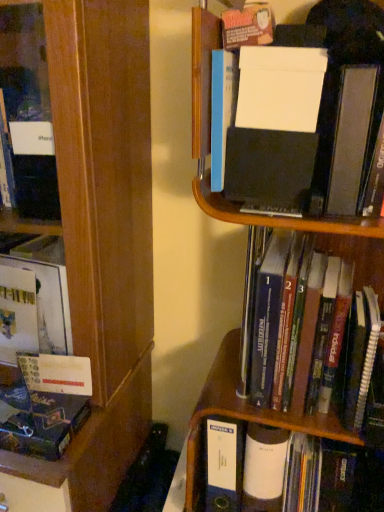
Question: Is wooden bookcase at left placed right next to white matte folder at upper right, marked as the 2th book in a right-to-left arrangement?

Choices:
 (A) yes
 (B) no

Answer: (B)

Question: Is wooden bookcase at left closer to the viewer compared to white matte folder at upper right, arranged as the third book when ordered from the bottom?

Choices:
 (A) no
 (B) yes

Answer: (B)

Question: Is wooden bookcase at left bigger than white matte folder at upper right, the 1th book in the top-to-bottom sequence?

Choices:
 (A) yes
 (B) no

Answer: (A)

Question: Considering the relative sizes of wooden bookcase at left and white matte folder at upper right, marked as the 2th book in a right-to-left arrangement, in the image provided, is wooden bookcase at left smaller than white matte folder at upper right, marked as the 2th book in a right-to-left arrangement,?

Choices:
 (A) no
 (B) yes

Answer: (A)

Question: Does wooden bookcase at left have a lesser height compared to white matte folder at upper right, marked as the 2th book in a right-to-left arrangement?

Choices:
 (A) no
 (B) yes

Answer: (A)

Question: From the image's perspective, does wooden bookcase at left appear higher than white matte folder at upper right, marked as the 2th book in a right-to-left arrangement?

Choices:
 (A) yes
 (B) no

Answer: (B)

Question: Are hardcover book at center, the 3th book from the left, and wooden bookcase at left located far from each other?

Choices:
 (A) no
 (B) yes

Answer: (A)

Question: Considering the relative positions of hardcover book at center, the 1th book positioned from the right, and wooden bookcase at left in the image provided, is hardcover book at center, the 1th book positioned from the right, to the left of wooden bookcase at left from the viewer's perspective?

Choices:
 (A) yes
 (B) no

Answer: (B)

Question: Does hardcover book at center, which is the second book in bottom-to-top order, turn towards wooden bookcase at left?

Choices:
 (A) no
 (B) yes

Answer: (A)

Question: Is wooden bookcase at left completely or partially inside hardcover book at center, which ranks as the 2th book in top-to-bottom order?

Choices:
 (A) yes
 (B) no

Answer: (B)

Question: Is hardcover book at center, which ranks as the 2th book in top-to-bottom order, behind wooden bookcase at left?

Choices:
 (A) no
 (B) yes

Answer: (B)

Question: From a real-world perspective, is hardcover book at center, the 3th book from the left, located higher than wooden bookcase at left?

Choices:
 (A) yes
 (B) no

Answer: (A)

Question: Is white matte folder at upper right, the 1th book in the top-to-bottom sequence, to the right of hardcover book at center, which is the second book in bottom-to-top order, from the viewer's perspective?

Choices:
 (A) no
 (B) yes

Answer: (A)